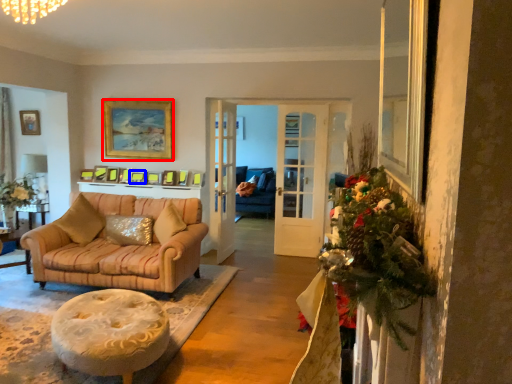
Question: Which object appears closest to the camera in this image, picture frame (highlighted by a red box) or picture frame (highlighted by a blue box)?

Choices:
 (A) picture frame
 (B) picture frame

Answer: (A)